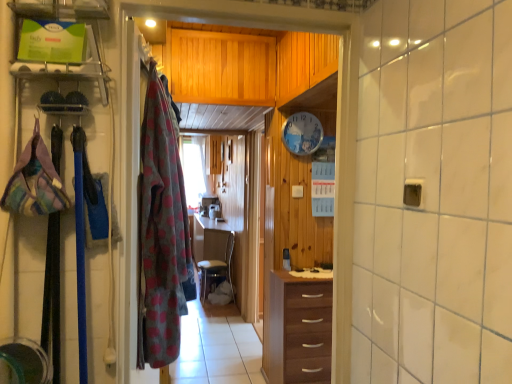
Question: Is brown wood chest of drawers at center to the left of plaid fabric bag at left, positioned as the 2th clothing in back-to-front order, from the viewer's perspective?

Choices:
 (A) no
 (B) yes

Answer: (A)

Question: From the image's perspective, would you say brown wood chest of drawers at center is shown under plaid fabric bag at left, which is the first clothing from front to back?

Choices:
 (A) yes
 (B) no

Answer: (A)

Question: Is brown wood chest of drawers at center shorter than plaid fabric bag at left, which ranks as the 2th clothing in right-to-left order?

Choices:
 (A) yes
 (B) no

Answer: (B)

Question: Is plaid fabric bag at left, which ranks as the 2th clothing in right-to-left order, at the back of brown wood chest of drawers at center?

Choices:
 (A) no
 (B) yes

Answer: (A)

Question: Would you say brown wood chest of drawers at center is a long distance from plaid fabric bag at left, which is the first clothing from front to back?

Choices:
 (A) yes
 (B) no

Answer: (A)

Question: Based on their positions, is plaid fabric bag at left, which is the first clothing from front to back, located to the left or right of fluffy polka dot blanket at left, which ranks as the 2th clothing in front-to-back order?

Choices:
 (A) right
 (B) left

Answer: (B)

Question: Considering the positions of point [15, 190] and point [159, 188], is point [15, 190] closer or farther from the camera than point [159, 188]?

Choices:
 (A) closer
 (B) farther

Answer: (A)

Question: Is plaid fabric bag at left, positioned as the 2th clothing in back-to-front order, wider or thinner than fluffy polka dot blanket at left, the first clothing positioned from the back?

Choices:
 (A) thin
 (B) wide

Answer: (A)

Question: Is plaid fabric bag at left, positioned as the 2th clothing in back-to-front order, spatially inside fluffy polka dot blanket at left, which ranks as the 2th clothing in front-to-back order, or outside of it?

Choices:
 (A) outside
 (B) inside

Answer: (A)

Question: Is point (221, 311) positioned closer to the camera than point (31, 206)?

Choices:
 (A) farther
 (B) closer

Answer: (A)

Question: Is wooden drawer at center situated inside plaid fabric bag at left, which is the first clothing from front to back, or outside?

Choices:
 (A) inside
 (B) outside

Answer: (B)

Question: From the image's perspective, is wooden drawer at center positioned above or below plaid fabric bag at left, which ranks as the 2th clothing in right-to-left order?

Choices:
 (A) above
 (B) below

Answer: (B)

Question: In the image, is wooden drawer at center on the left side or the right side of plaid fabric bag at left, positioned as the 2th clothing in back-to-front order?

Choices:
 (A) right
 (B) left

Answer: (A)

Question: Visually, is clear plastic shelf at upper left positioned to the left or to the right of brown wood chest of drawers at center?

Choices:
 (A) right
 (B) left

Answer: (B)

Question: From the image's perspective, is clear plastic shelf at upper left positioned above or below brown wood chest of drawers at center?

Choices:
 (A) above
 (B) below

Answer: (A)